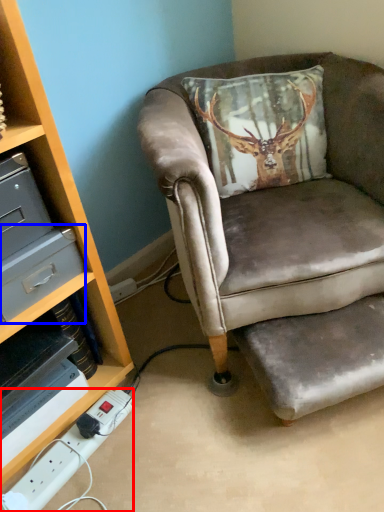
Question: Among these objects, which one is farthest to the camera, power outlet (highlighted by a red box) or drawer (highlighted by a blue box)?

Choices:
 (A) power outlet
 (B) drawer

Answer: (A)